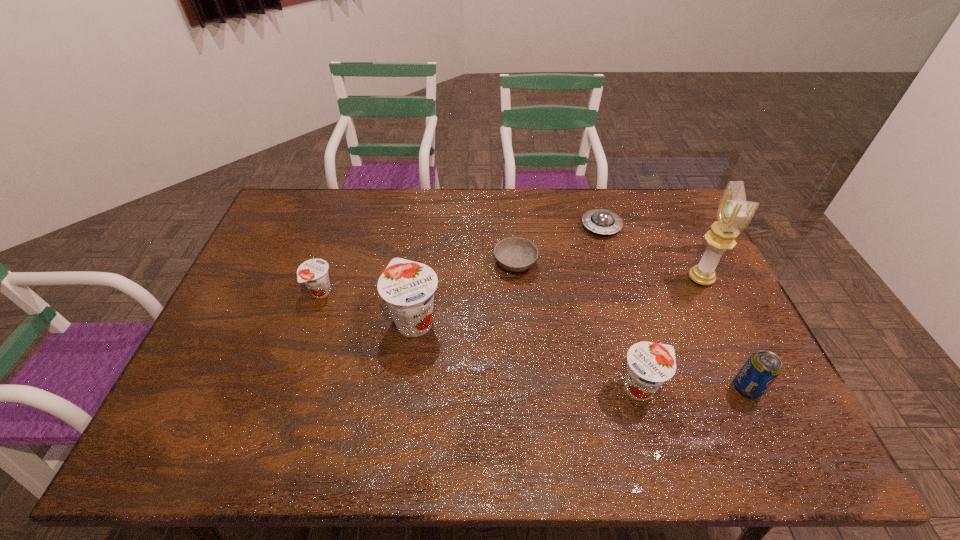
This screenshot has width=960, height=540. In order to click on the leftmost object in this screenshot , I will do `click(314, 273)`.

Where is `the leftmost yogurt`? the leftmost yogurt is located at coordinates (314, 273).

Locate an element on the screen. This screenshot has width=960, height=540. the second yogurt from left to right is located at coordinates (408, 287).

Find the location of a particular element. the second object from left to right is located at coordinates (408, 287).

Identify the location of the second shortest yogurt. click(x=650, y=364).

This screenshot has width=960, height=540. Identify the location of the nearest yogurt. (650, 364).

This screenshot has width=960, height=540. What are the coordinates of `saucer` in the screenshot? It's located at (601, 221).

Find the location of `bowl`. bowl is located at coordinates (515, 254).

Locate an element on the screen. award is located at coordinates (734, 214).

The width and height of the screenshot is (960, 540). I want to click on soda, so click(x=762, y=368).